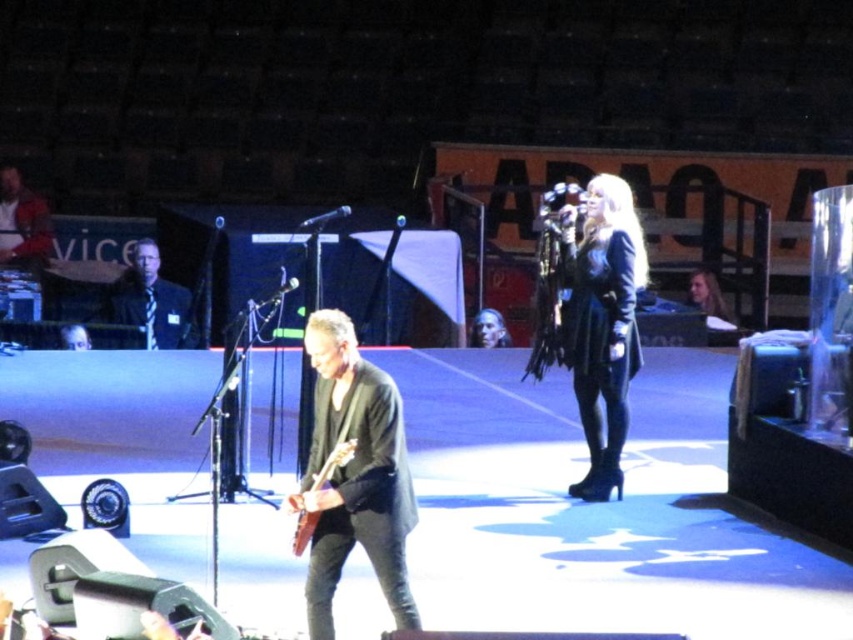
What is the object located at the coordinates point (354, 476) in the scene?

The point (354, 476) marks the location of the dark gray leather jacket at center.

You are a photographer standing at the front of the stage. You want to take a photo that includes both the point at coordinates point [405,509] and point [109,314]. Which point should you focus on first to ensure both are in sharp focus?

You should focus on point [405,509] first because it is closer to the camera than point [109,314], ensuring both points are within the depth of field.